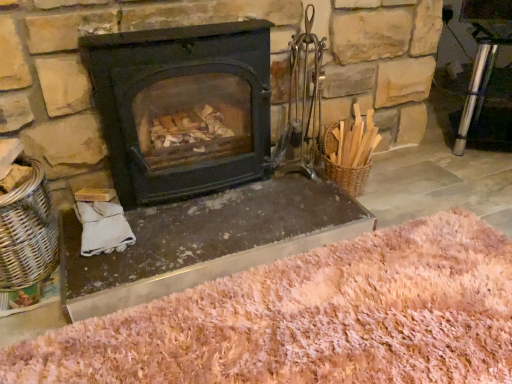
You are a GUI agent. You are given a task and a screenshot of the screen. Output one action in this format:
    pyautogui.click(x=<x>, y=<y>)
    Task: Click on the free space in front of matte black wood burning stove at center
    
    Given the screenshot: What is the action you would take?
    pyautogui.click(x=190, y=240)